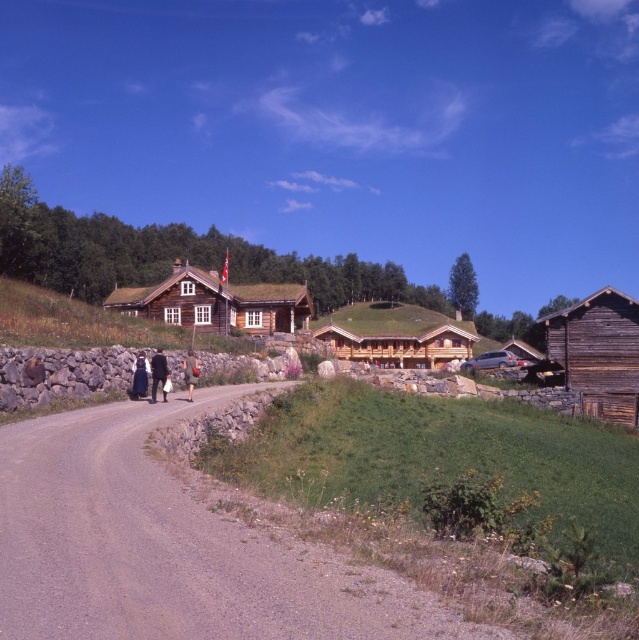
Question: Which point appears farthest from the camera in this image?

Choices:
 (A) [144, 376]
 (B) [610, 374]

Answer: (B)

Question: Is brown wooden hut at center wider than black fabric dress at center?

Choices:
 (A) no
 (B) yes

Answer: (B)

Question: Among these objects, which one is farthest from the camera?

Choices:
 (A) dark brown leather boots at center
 (B) brown wooden hut at center

Answer: (B)

Question: Which of the following is the farthest from the observer?

Choices:
 (A) (551, 349)
 (B) (148, 432)
 (C) (256, 308)

Answer: (C)

Question: Can you confirm if wooden cabin at center is smaller than brown wooden hut at center?

Choices:
 (A) no
 (B) yes

Answer: (A)

Question: Does brown gravel road at center have a larger size compared to dark blue fabric coat at center?

Choices:
 (A) yes
 (B) no

Answer: (A)